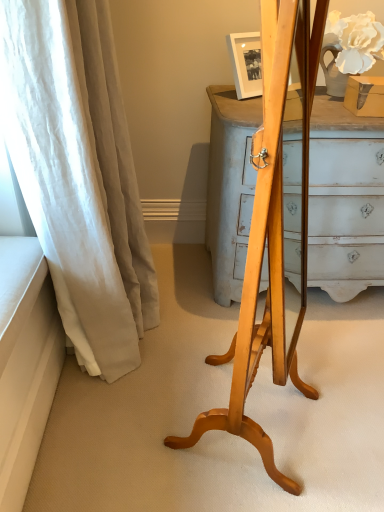
Question: Is white linen curtain at left to the right of light wood easel at center from the viewer's perspective?

Choices:
 (A) yes
 (B) no

Answer: (B)

Question: Can you confirm if white linen curtain at left is thinner than light wood easel at center?

Choices:
 (A) yes
 (B) no

Answer: (B)

Question: Considering the relative sizes of white linen curtain at left and light wood easel at center in the image provided, is white linen curtain at left taller than light wood easel at center?

Choices:
 (A) yes
 (B) no

Answer: (B)

Question: Is light wood easel at center surrounded by white linen curtain at left?

Choices:
 (A) no
 (B) yes

Answer: (A)

Question: Does white linen curtain at left come behind light wood easel at center?

Choices:
 (A) no
 (B) yes

Answer: (B)

Question: Does white linen curtain at left lie in front of light wood easel at center?

Choices:
 (A) yes
 (B) no

Answer: (B)

Question: From a real-world perspective, is light wood easel at center on white linen curtain at left?

Choices:
 (A) yes
 (B) no

Answer: (A)

Question: Considering the relative sizes of light wood easel at center and white linen curtain at left in the image provided, is light wood easel at center wider than white linen curtain at left?

Choices:
 (A) yes
 (B) no

Answer: (B)

Question: From the image's perspective, does light wood easel at center appear lower than white linen curtain at left?

Choices:
 (A) no
 (B) yes

Answer: (B)

Question: Is light wood easel at center further to the viewer compared to white linen curtain at left?

Choices:
 (A) yes
 (B) no

Answer: (B)

Question: From the image's perspective, is light wood easel at center located above white linen curtain at left?

Choices:
 (A) no
 (B) yes

Answer: (A)

Question: Is light wood easel at center located outside white linen curtain at left?

Choices:
 (A) no
 (B) yes

Answer: (B)

Question: Considering the positions of white linen curtain at left and light wood easel at center in the image, is white linen curtain at left taller or shorter than light wood easel at center?

Choices:
 (A) short
 (B) tall

Answer: (A)